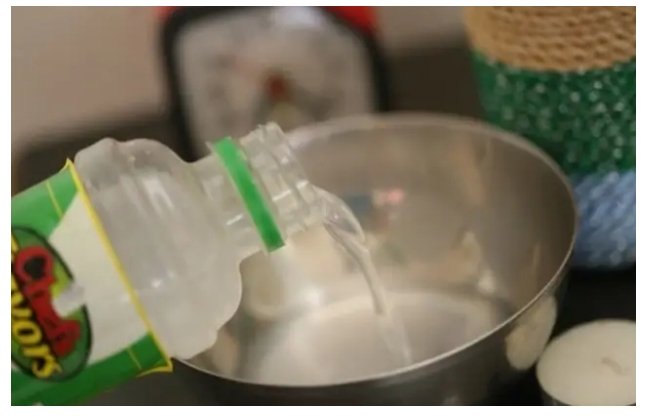
Image resolution: width=650 pixels, height=420 pixels. I want to click on clock, so click(179, 15).